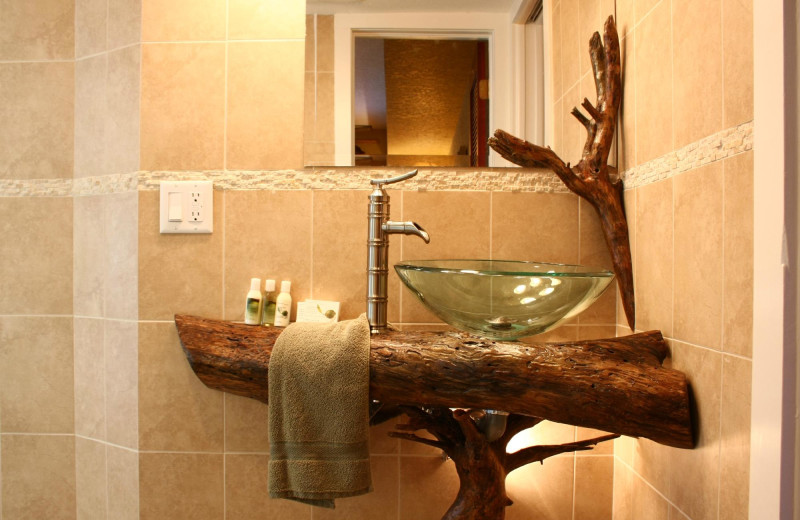
I want to click on sink rim, so click(501, 272), click(545, 258).